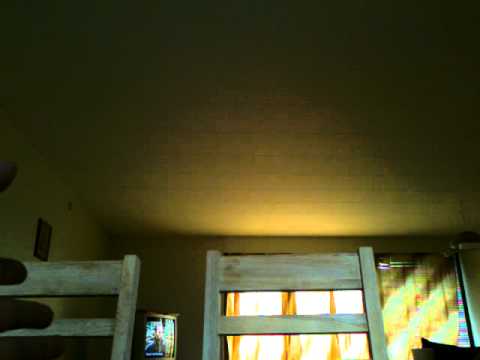
Locate an element on the screen. This screenshot has width=480, height=360. tv is located at coordinates (163, 335).